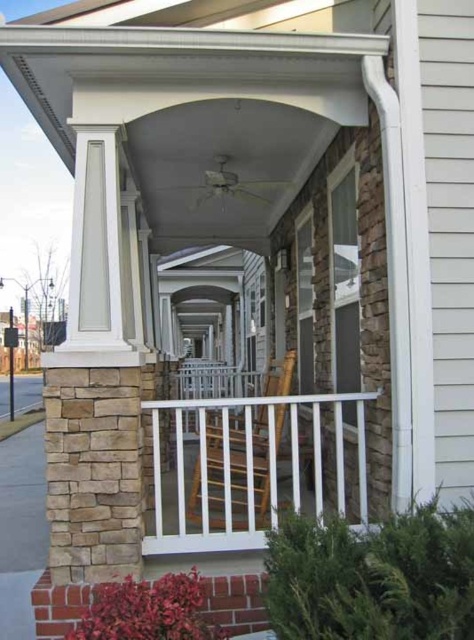
Question: Is white plastic balustrade at center to the right of wooden rocking chair at center from the viewer's perspective?

Choices:
 (A) yes
 (B) no

Answer: (B)

Question: Which object appears farthest from the camera in this image?

Choices:
 (A) white plastic balustrade at center
 (B) wooden rocking chair at center

Answer: (B)

Question: Can you confirm if white plastic balustrade at center is wider than wooden rocking chair at center?

Choices:
 (A) yes
 (B) no

Answer: (A)

Question: Which point is farther to the camera?

Choices:
 (A) (155, 410)
 (B) (242, 509)

Answer: (B)

Question: Does white plastic balustrade at center appear on the right side of wooden rocking chair at center?

Choices:
 (A) no
 (B) yes

Answer: (A)